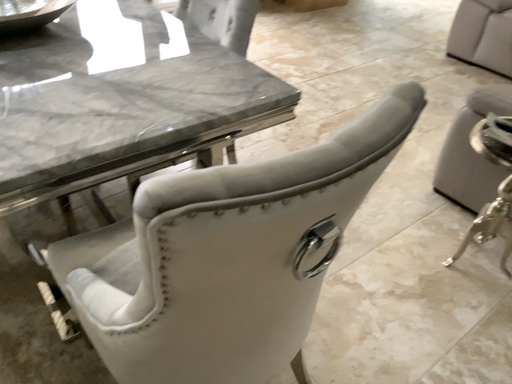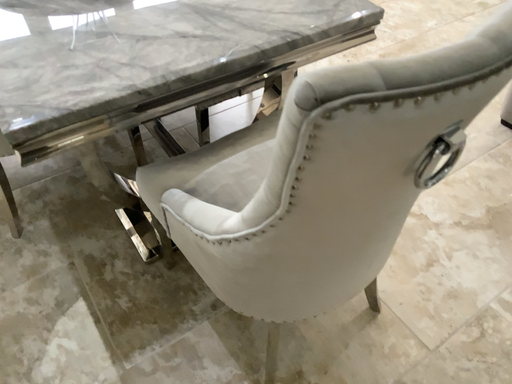
Question: How did the camera likely rotate when shooting the video?

Choices:
 (A) rotated upward
 (B) rotated downward

Answer: (B)